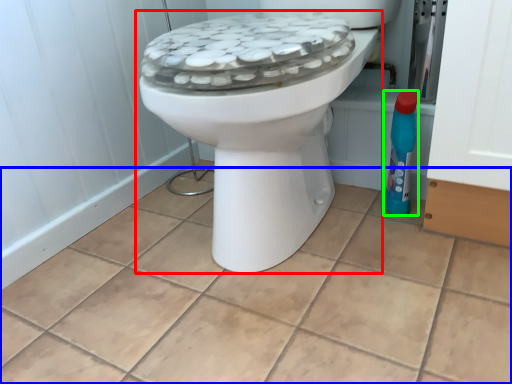
Question: Considering the real-world distances, which object is farthest from toilet (highlighted by a red box)? ceramic tile (highlighted by a blue box) or cleaning product (highlighted by a green box)?

Choices:
 (A) ceramic tile
 (B) cleaning product

Answer: (B)